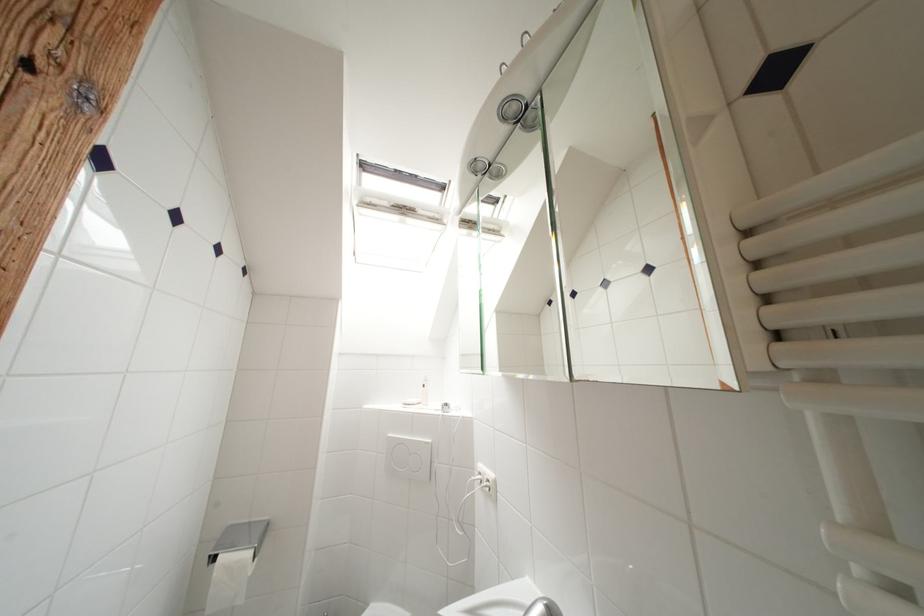
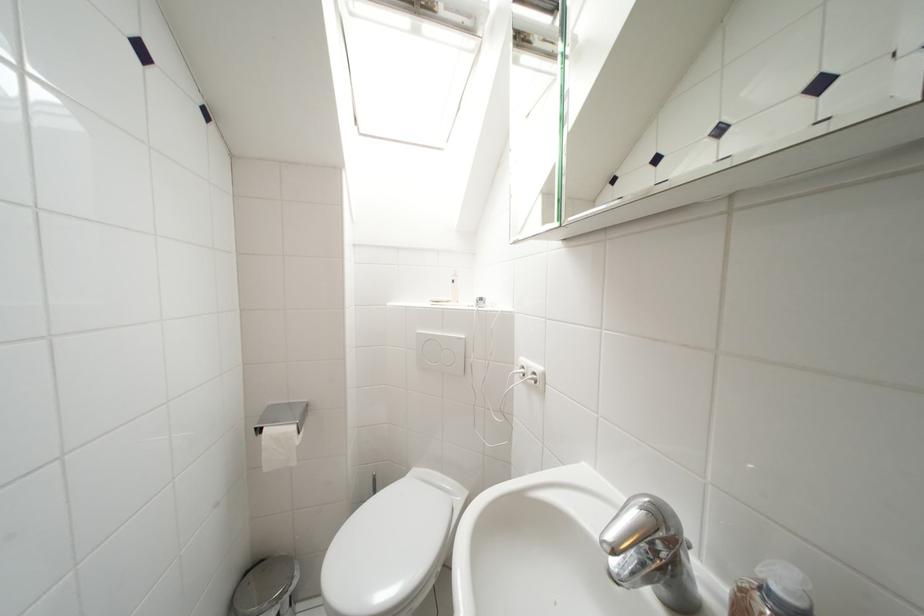
Find the pixel in the second image that matches (x=238, y=549) in the first image.

(283, 424)